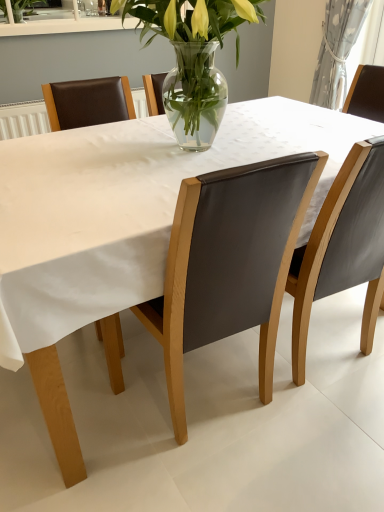
Question: Can you confirm if white textured curtain at upper right is positioned to the right of matte gray chair at right, the 1th chair in the right-to-left sequence?

Choices:
 (A) no
 (B) yes

Answer: (B)

Question: Considering the relative sizes of white textured curtain at upper right and matte gray chair at right, placed as the second chair when sorted from left to right, in the image provided, is white textured curtain at upper right thinner than matte gray chair at right, placed as the second chair when sorted from left to right,?

Choices:
 (A) no
 (B) yes

Answer: (B)

Question: Can you confirm if white textured curtain at upper right is smaller than matte gray chair at right, the 1th chair in the right-to-left sequence?

Choices:
 (A) yes
 (B) no

Answer: (A)

Question: Is white textured curtain at upper right oriented towards matte gray chair at right, placed as the second chair when sorted from left to right?

Choices:
 (A) no
 (B) yes

Answer: (A)

Question: Is white textured curtain at upper right at the left side of matte gray chair at right, placed as the second chair when sorted from left to right?

Choices:
 (A) yes
 (B) no

Answer: (B)

Question: Are white textured curtain at upper right and matte gray chair at right, the 1th chair in the right-to-left sequence, located far from each other?

Choices:
 (A) yes
 (B) no

Answer: (A)

Question: Can you confirm if white textured curtain at upper right is positioned to the right of leather at center, positioned as the first chair in left-to-right order?

Choices:
 (A) yes
 (B) no

Answer: (A)

Question: Does white textured curtain at upper right have a smaller size compared to leather at center, positioned as the first chair in left-to-right order?

Choices:
 (A) yes
 (B) no

Answer: (A)

Question: Can you confirm if white textured curtain at upper right is shorter than leather at center, positioned as the first chair in left-to-right order?

Choices:
 (A) no
 (B) yes

Answer: (B)

Question: Does white textured curtain at upper right touch leather at center, positioned as the first chair in left-to-right order?

Choices:
 (A) yes
 (B) no

Answer: (B)

Question: From a real-world perspective, is white textured curtain at upper right located higher than leather at center, positioned as the first chair in left-to-right order?

Choices:
 (A) yes
 (B) no

Answer: (A)

Question: Is leather at center, the 2th chair viewed from the right, surrounded by white textured curtain at upper right?

Choices:
 (A) yes
 (B) no

Answer: (B)

Question: Is leather at center, the 2th chair viewed from the right, far away from white textured curtain at upper right?

Choices:
 (A) yes
 (B) no

Answer: (A)